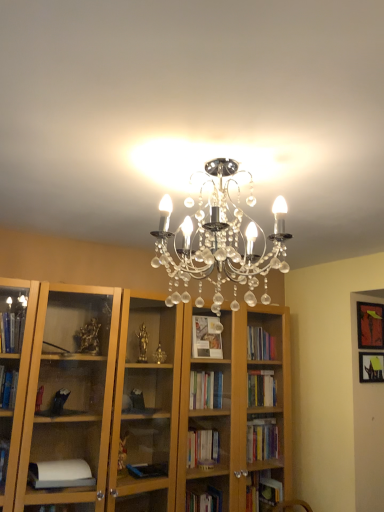
Question: From a real-world perspective, is matte black picture frame at upper right, placed as the 2th picture frame when sorted from bottom to top, above or below matte black picture frame at upper right, the 2th picture frame from the top?

Choices:
 (A) below
 (B) above

Answer: (B)

Question: In terms of height, does matte black picture frame at upper right, placed as the first picture frame when sorted from top to bottom, look taller or shorter compared to matte black picture frame at upper right, the 2th picture frame from the top?

Choices:
 (A) short
 (B) tall

Answer: (B)

Question: In terms of width, does matte black picture frame at upper right, placed as the 2th picture frame when sorted from bottom to top, look wider or thinner when compared to matte black picture frame at upper right, the 2th picture frame from the top?

Choices:
 (A) thin
 (B) wide

Answer: (B)

Question: Is matte black picture frame at upper right, positioned as the 1th picture frame in bottom-to-top order, in front of or behind matte black picture frame at upper right, placed as the first picture frame when sorted from top to bottom, in the image?

Choices:
 (A) front
 (B) behind

Answer: (A)

Question: From a real-world perspective, is matte black picture frame at upper right, the 2th picture frame from the top, physically located above or below matte black picture frame at upper right, placed as the 2th picture frame when sorted from bottom to top?

Choices:
 (A) above
 (B) below

Answer: (B)

Question: Is point (379, 372) positioned closer to the camera than point (375, 321)?

Choices:
 (A) closer
 (B) farther

Answer: (B)

Question: Is matte black picture frame at upper right, positioned as the 1th picture frame in bottom-to-top order, bigger or smaller than matte black picture frame at upper right, placed as the 2th picture frame when sorted from bottom to top?

Choices:
 (A) small
 (B) big

Answer: (A)